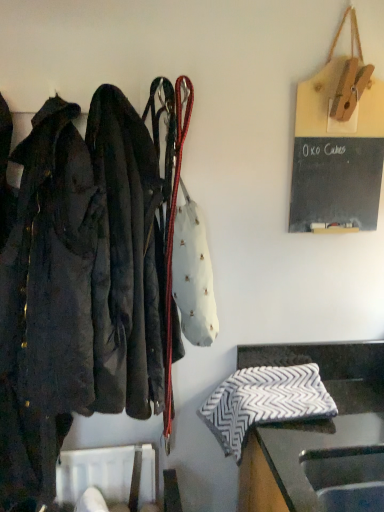
Question: From the image's perspective, is wooden clipboard at upper right located above white leather handbag at center?

Choices:
 (A) no
 (B) yes

Answer: (B)

Question: Can you confirm if wooden clipboard at upper right is positioned to the right of white leather handbag at center?

Choices:
 (A) no
 (B) yes

Answer: (B)

Question: From the image's perspective, would you say wooden clipboard at upper right is shown under white leather handbag at center?

Choices:
 (A) yes
 (B) no

Answer: (B)

Question: Are wooden clipboard at upper right and white leather handbag at center far apart?

Choices:
 (A) no
 (B) yes

Answer: (A)

Question: Are wooden clipboard at upper right and white leather handbag at center making contact?

Choices:
 (A) no
 (B) yes

Answer: (A)

Question: Is white leather handbag at center a part of wooden clipboard at upper right?

Choices:
 (A) no
 (B) yes

Answer: (A)

Question: Is black and white zigzag-patterned cloth at lower right at the right side of wooden clipboard at upper right?

Choices:
 (A) no
 (B) yes

Answer: (A)

Question: Can you confirm if black and white zigzag-patterned cloth at lower right is positioned to the left of wooden clipboard at upper right?

Choices:
 (A) no
 (B) yes

Answer: (B)

Question: Does black and white zigzag-patterned cloth at lower right turn towards wooden clipboard at upper right?

Choices:
 (A) yes
 (B) no

Answer: (B)

Question: Is black and white zigzag-patterned cloth at lower right far from wooden clipboard at upper right?

Choices:
 (A) no
 (B) yes

Answer: (A)

Question: Does black and white zigzag-patterned cloth at lower right have a greater width compared to wooden clipboard at upper right?

Choices:
 (A) no
 (B) yes

Answer: (B)

Question: Is black and white zigzag-patterned cloth at lower right beside wooden clipboard at upper right?

Choices:
 (A) yes
 (B) no

Answer: (B)

Question: Does white leather handbag at center appear on the right side of black and white zigzag-patterned cloth at lower right?

Choices:
 (A) yes
 (B) no

Answer: (B)